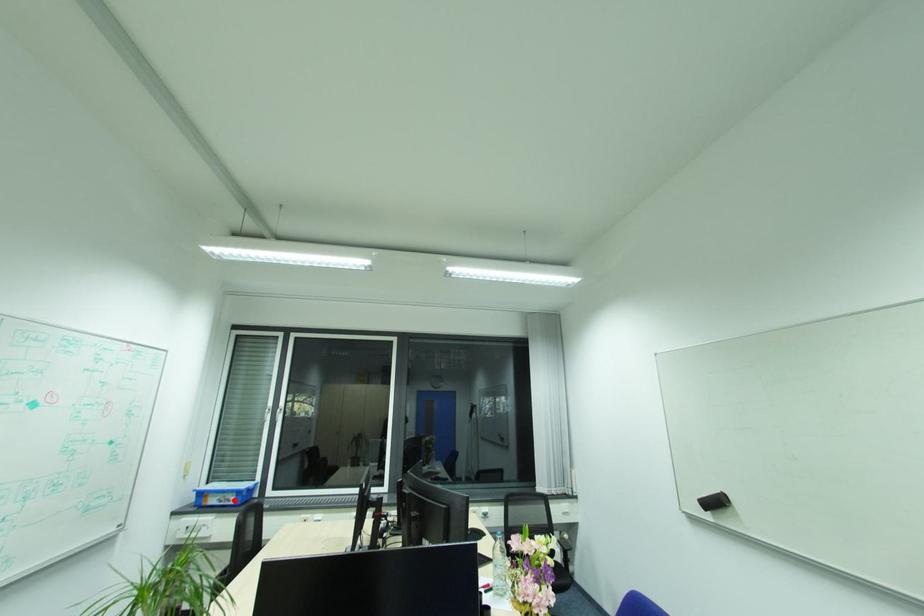
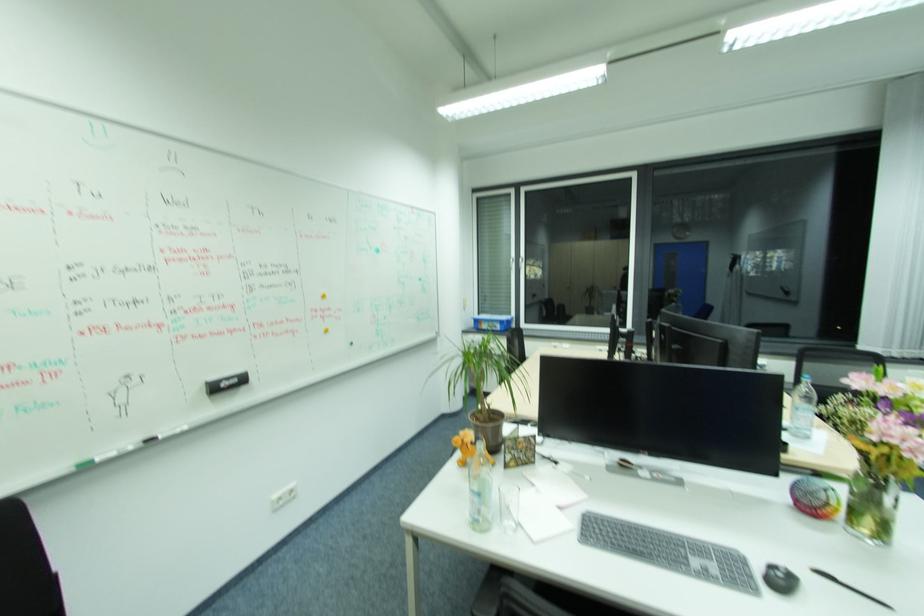
The point at the highlighted location is marked in the first image. Where is the corresponding point in the second image?

(502, 326)